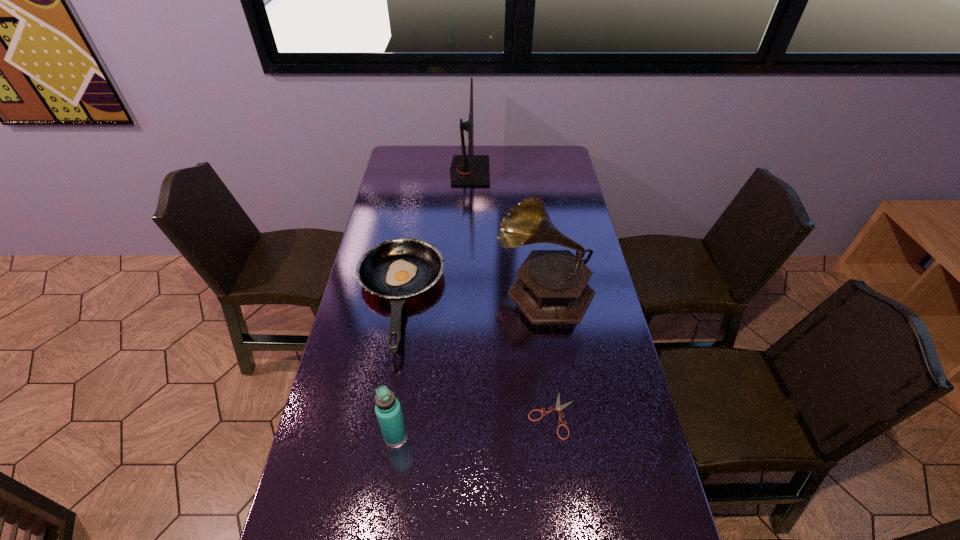
This screenshot has height=540, width=960. Find the location of `blank region between the phonograph record and the thermos bottle`. blank region between the phonograph record and the thermos bottle is located at coordinates (470, 362).

Find the location of a particular element. The width and height of the screenshot is (960, 540). vacant point located between the thermos bottle and the monitor is located at coordinates (433, 303).

Where is `free space between the third tallest object and the shears`? free space between the third tallest object and the shears is located at coordinates (473, 425).

Identify the location of vacant area between the thermos bottle and the phonograph record. The height and width of the screenshot is (540, 960). (470, 362).

Locate an element on the screen. empty location between the phonograph record and the shears is located at coordinates (548, 352).

Locate an element on the screen. This screenshot has width=960, height=540. free space between the thermos bottle and the fourth tallest object is located at coordinates (396, 367).

Locate an element on the screen. The height and width of the screenshot is (540, 960). free area in between the shears and the third tallest object is located at coordinates (473, 425).

Identify which object is the third closest to the farthest object. Please provide its 2D coordinates. Your answer should be formatted as a tuple, i.e. [(x, y)], where the tuple contains the x and y coordinates of a point satisfying the conditions above.

[(558, 408)]

Locate an element on the screen. The width and height of the screenshot is (960, 540). the closest object to the phonograph record is located at coordinates (399, 268).

I want to click on free point that satisfies the following two spatial constraints: 1. on the screen side of the monitor; 2. on the right side of the shortest object, so click(x=462, y=415).